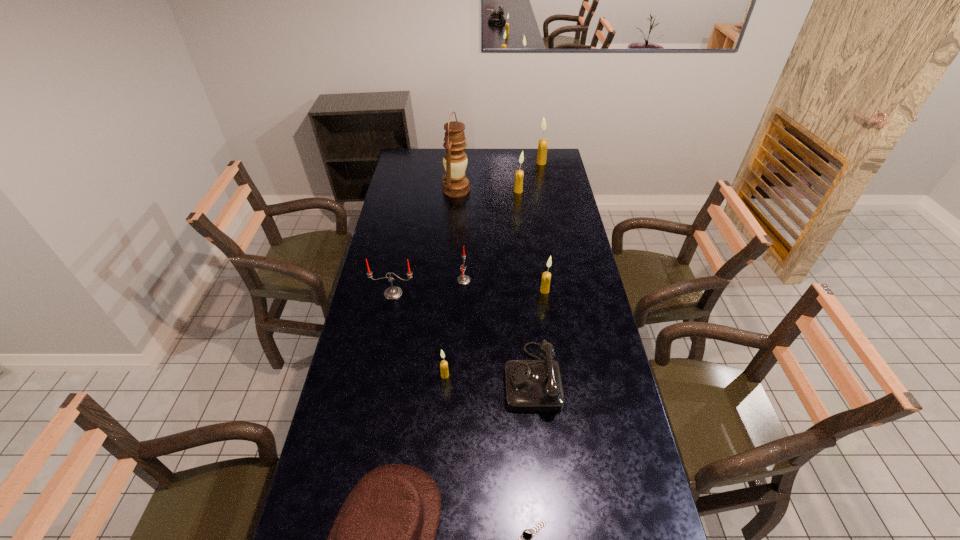
The height and width of the screenshot is (540, 960). Find the location of `free space located on the dial of the black telephone`. free space located on the dial of the black telephone is located at coordinates (446, 377).

The width and height of the screenshot is (960, 540). Find the location of `vacant space located 0.150m on the dial of the black telephone`. vacant space located 0.150m on the dial of the black telephone is located at coordinates (459, 377).

This screenshot has width=960, height=540. I want to click on free space located 0.140m on the front of the smallest cream candle, so click(442, 418).

Identify the location of blank area located 0.210m on the front-facing side of the smaller red candle. (522, 280).

The image size is (960, 540). I want to click on object present at the far edge, so click(x=543, y=143).

The image size is (960, 540). Identify the location of object that is positioned at the left edge. (393, 292).

Identify the location of object that is at the right edge. The width and height of the screenshot is (960, 540). (543, 143).

Where is `object that is positioned at the far right corner`? Image resolution: width=960 pixels, height=540 pixels. object that is positioned at the far right corner is located at coordinates (543, 143).

Locate an element on the screen. The height and width of the screenshot is (540, 960). blank space at the far edge of the desktop is located at coordinates (477, 166).

This screenshot has width=960, height=540. Find the location of `vacant space at the left edge of the desktop`. vacant space at the left edge of the desktop is located at coordinates (416, 191).